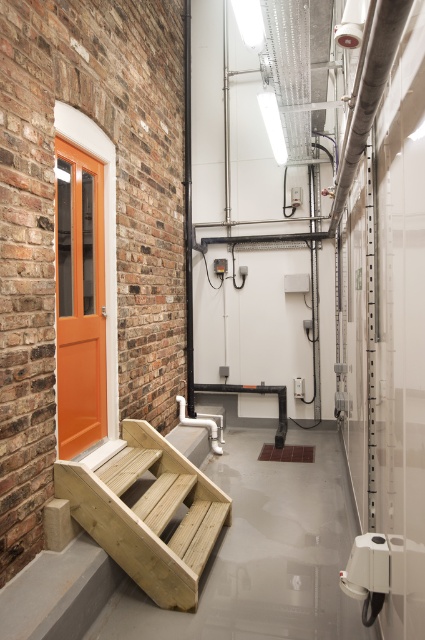
You are a delivery person carrying a heavy box and need to reach the orange painted wood door at left. The natural wood stairs at lower left are in your way. Can you step over them to avoid climbing?

The natural wood stairs at lower left is located below the orange painted wood door at left, meaning they are positioned lower and directly in the path leading to the door. Since the stairs are below the door, you would need to climb them to reach the door, so stepping over them isn

You are moving a large wooden box into the corridor and need to place it near the natural wood stairs at lower left and the orange painted wood door at left. Which object should you place the box closer to if you want it to be proportionally smaller compared to the object it is near?

You should place the large wooden box closer to the orange painted wood door at left because the natural wood stairs at lower left is bigger than the orange painted wood door at left, so the box will look proportionally smaller next to the door.

You are standing in the corridor and need to reach the orange painted wood door at left. You see the natural wood stairs at lower left in your way. Which direction should you move to avoid the stairs and reach the door?

To reach the orange painted wood door at left while avoiding the natural wood stairs at lower left, you should move to the left since the stairs are positioned to the right of the door.